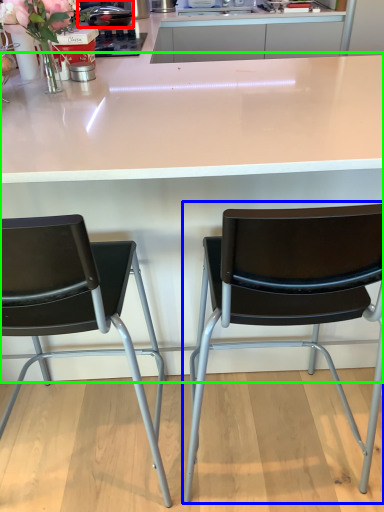
Question: Which object is the closest to the appliance (highlighted by a red box)? Choose among these: chair (highlighted by a blue box) or table (highlighted by a green box).

Choices:
 (A) chair
 (B) table

Answer: (B)